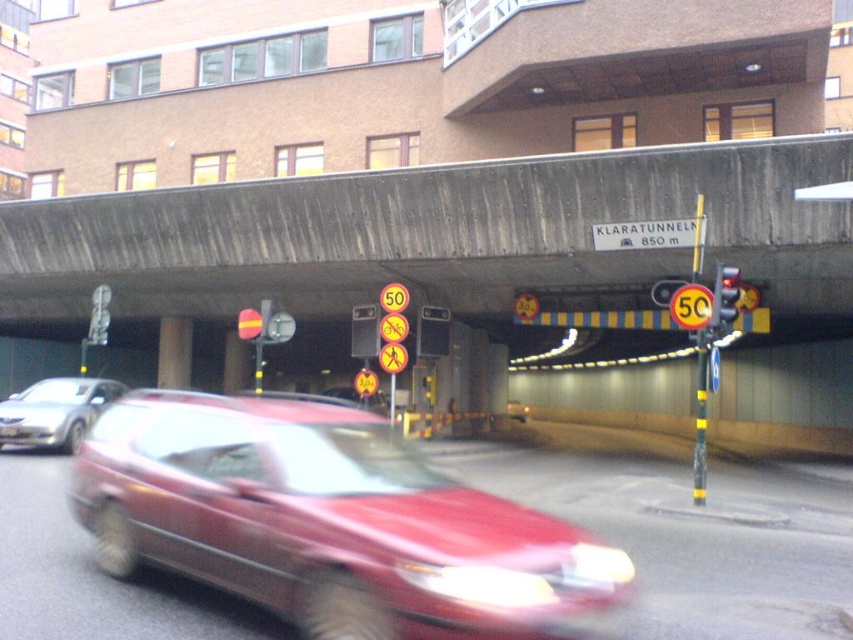
Question: Which object appears closest to the camera in this image?

Choices:
 (A) shiny red car at center
 (B) concrete overpass at center
 (C) silver metallic sedan at left
 (D) yellow reflective bicycle at center

Answer: (A)

Question: Is silver metallic sedan at left thinner than yellow reflective pedestrian crossing sign at center?

Choices:
 (A) yes
 (B) no

Answer: (B)

Question: Is concrete overpass at center wider than metallic traffic light at right?

Choices:
 (A) no
 (B) yes

Answer: (B)

Question: Which of the following is the closest to the observer?

Choices:
 (A) silver metallic sedan at left
 (B) yellow circular sign at center
 (C) shiny red car at center
 (D) metallic pole at right

Answer: (C)

Question: Does yellow reflective bicycle at center have a lesser width compared to yellow reflective circle at center?

Choices:
 (A) yes
 (B) no

Answer: (B)

Question: Which point is closer to the camera?

Choices:
 (A) silver metallic sedan at left
 (B) yellow reflective pedestrian crossing sign at center
 (C) metallic pole at right

Answer: (C)